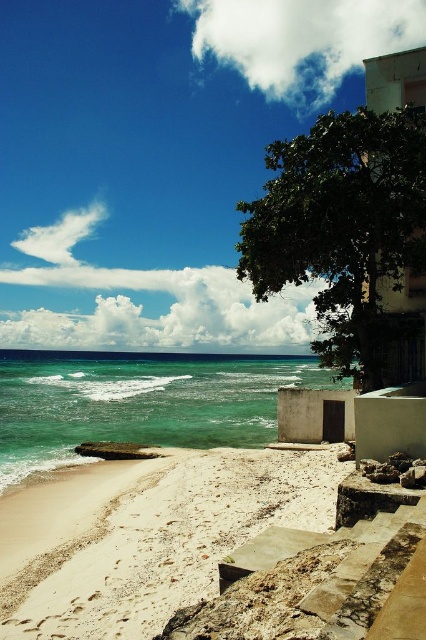
Between white sandy beach at lower left and clear turquoise water at center, which one is positioned higher?

Positioned higher is white sandy beach at lower left.

Who is lower down, white sandy beach at lower left or clear turquoise water at center?

clear turquoise water at center is below.

Is point (160, 604) positioned after point (138, 397)?

No, it is not.

Locate an element on the screen. This screenshot has height=640, width=426. white sandy beach at lower left is located at coordinates (146, 536).

Between white sandy beach at lower left and green leafy tree at upper right, which one has less height?

Standing shorter between the two is white sandy beach at lower left.

Image resolution: width=426 pixels, height=640 pixels. What do you see at coordinates (146, 536) in the screenshot?
I see `white sandy beach at lower left` at bounding box center [146, 536].

Where is `white sandy beach at lower left`? This screenshot has width=426, height=640. white sandy beach at lower left is located at coordinates (146, 536).

Is the position of green leafy tree at upper right more distant than that of clear turquoise water at center?

No, it is in front of clear turquoise water at center.

Between green leafy tree at upper right and clear turquoise water at center, which one is positioned lower?

clear turquoise water at center is below.

What do you see at coordinates (342, 228) in the screenshot? I see `green leafy tree at upper right` at bounding box center [342, 228].

Where is `green leafy tree at upper right`? Image resolution: width=426 pixels, height=640 pixels. green leafy tree at upper right is located at coordinates (342, 228).